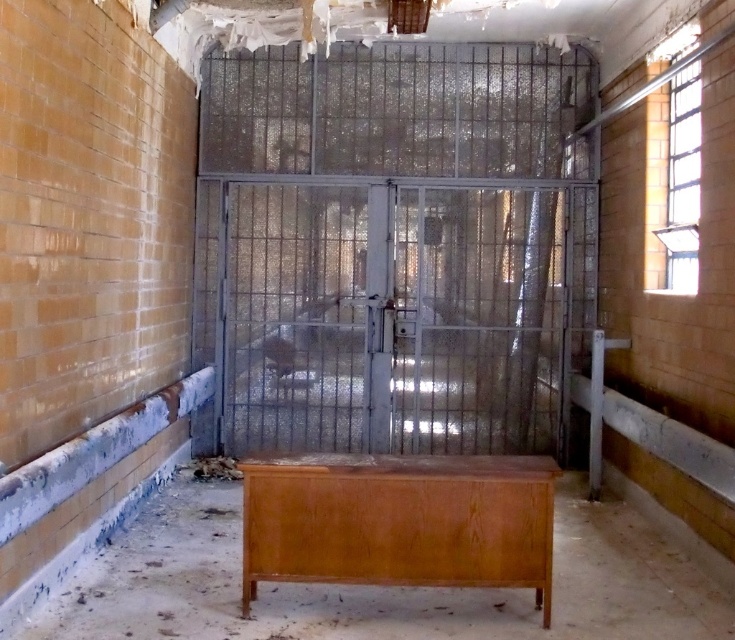
You are a maintenance worker needing to access the wooden cabinet at center. The metallic wire cage at center is blocking your path. Can you move around the cage to reach the cabinet?

The wooden cabinet at center is behind the metallic wire cage at center, so you can move around the cage to reach the cabinet since it is positioned behind it.

You are a delivery person who needs to bring a large package through the room. The package is wider than the wooden cabinet at center. Can you pass through the metallic wire cage at center with your package?

The metallic wire cage at center has a larger width than the wooden cabinet at center. Since your package is wider than the wooden cabinet at center, it may still be too wide to fit through the metallic wire cage at center. You should measure the package against the cage to confirm.

From the picture: Please describe the object located at the coordinates point (395, 246) in the image. What is it?

The point (395, 246) marks a metallic wire cage at center.